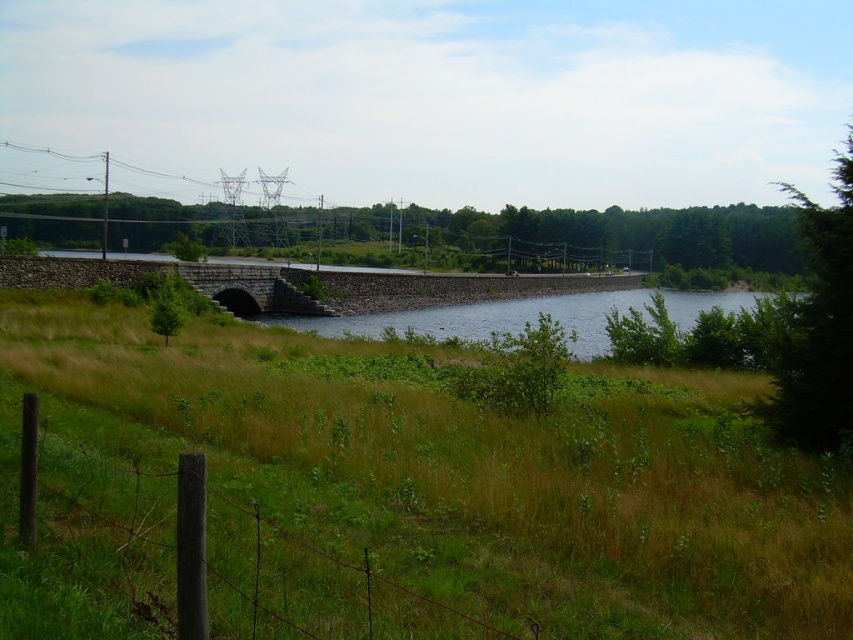
Which is more to the left, green grassy at center or stone bridge at center?

From the viewer's perspective, stone bridge at center appears more on the left side.

Is green grassy at center positioned behind stone bridge at center?

That is False.

Is point (613, 536) less distant than point (260, 266)?

Yes, point (613, 536) is closer to viewer.

Image resolution: width=853 pixels, height=640 pixels. What are the coordinates of `green grassy at center` in the screenshot? It's located at (401, 490).

Between point (665, 292) and point (265, 285), which one is positioned in front?

Positioned in front is point (265, 285).

Does blue concrete river at center have a larger size compared to stone bridge at center?

Yes.

This screenshot has width=853, height=640. I want to click on blue concrete river at center, so click(529, 316).

Between green grassy at center and blue concrete river at center, which one is positioned lower?

green grassy at center is below.

Between green grassy at center and blue concrete river at center, which one is positioned higher?

blue concrete river at center is higher up.

Where is `green grassy at center`? This screenshot has height=640, width=853. green grassy at center is located at coordinates (401, 490).

At what (x,y) coordinates should I click in order to perform the action: click on green grassy at center. Please return your answer as a coordinate pair (x, y). This screenshot has height=640, width=853. Looking at the image, I should click on [x=401, y=490].